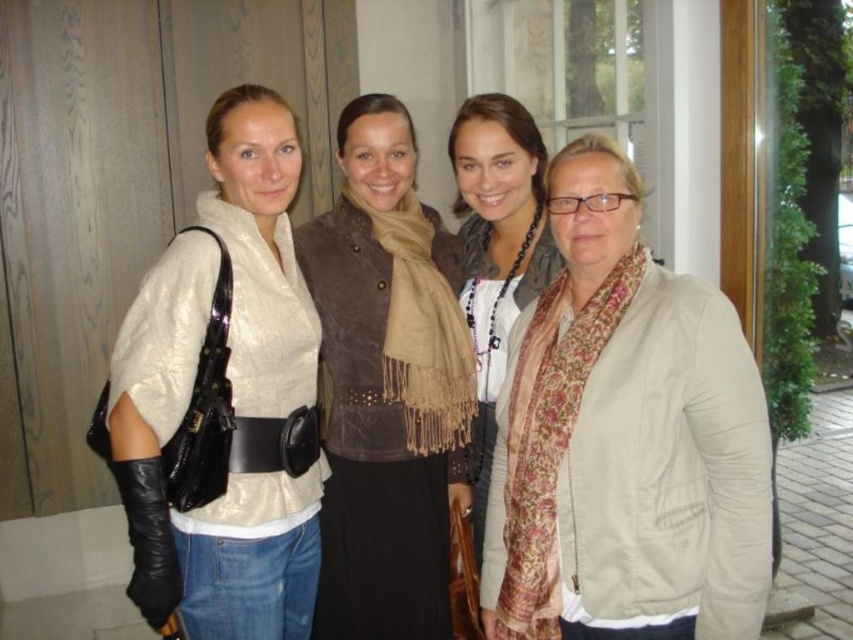
From the picture: Can you confirm if beige fabric jacket at center is smaller than brown suede vest at center?

Incorrect, beige fabric jacket at center is not smaller in size than brown suede vest at center.

Which of these two, beige fabric jacket at center or brown suede vest at center, stands taller?

brown suede vest at center

Measure the distance between point (566,524) and camera.

The distance of point (566,524) from camera is 4.75 feet.

Locate an element on the screen. beige fabric jacket at center is located at coordinates (625, 440).

Which of these two, beige fabric jacket at center or floral scarf at center, stands shorter?

beige fabric jacket at center is shorter.

Looking at this image, who is positioned more to the right, beige fabric jacket at center or floral scarf at center?

beige fabric jacket at center is more to the right.

Where is `beige fabric jacket at center`? This screenshot has width=853, height=640. beige fabric jacket at center is located at coordinates (625, 440).

Is matte white blouse at left below floral scarf at center?

Yes.

Between point (149, 506) and point (461, 294), which one is positioned behind?

The point (461, 294) is more distant.

This screenshot has width=853, height=640. In order to click on matte white blouse at left in this screenshot , I will do `click(213, 499)`.